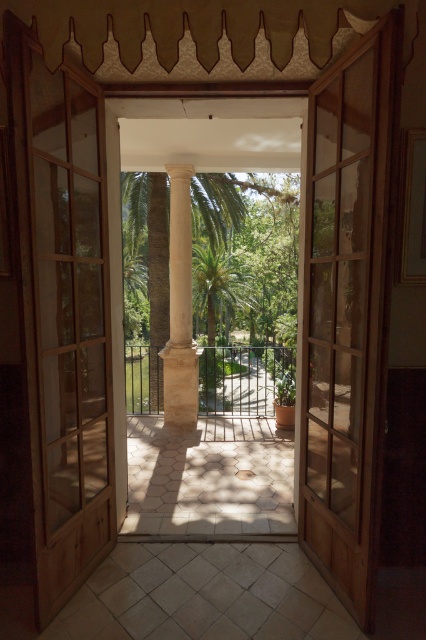
Question: Does clear wood glass door at center have a larger size compared to white stone column at center?

Choices:
 (A) no
 (B) yes

Answer: (A)

Question: Which object is the farthest from the clear wood glass door at center?

Choices:
 (A) wooden door at center
 (B) white stone column at center

Answer: (B)

Question: Which point is closer to the camera taking this photo?

Choices:
 (A) (51, 172)
 (B) (190, 392)
 (C) (373, 435)

Answer: (C)

Question: Which object appears closest to the camera in this image?

Choices:
 (A) white stone column at center
 (B) clear wood glass door at center

Answer: (B)

Question: Does wooden door at center come in front of white stone column at center?

Choices:
 (A) no
 (B) yes

Answer: (B)

Question: Is clear wood glass door at center below white stone column at center?

Choices:
 (A) yes
 (B) no

Answer: (A)